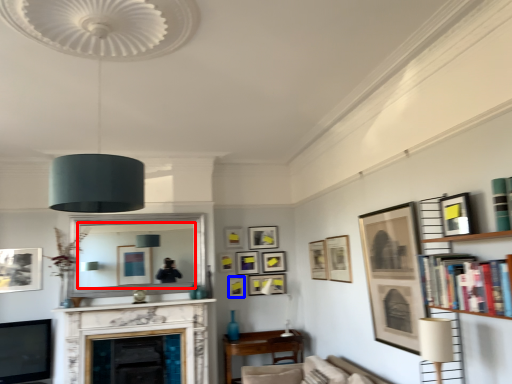
Question: Among these objects, which one is farthest to the camera, mirror (highlighted by a red box) or picture frame (highlighted by a blue box)?

Choices:
 (A) mirror
 (B) picture frame

Answer: (B)